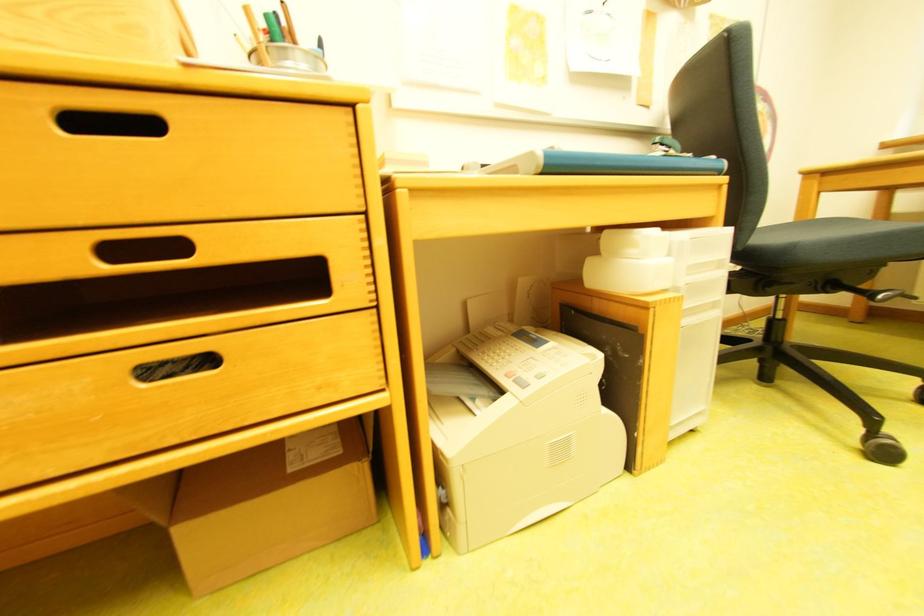
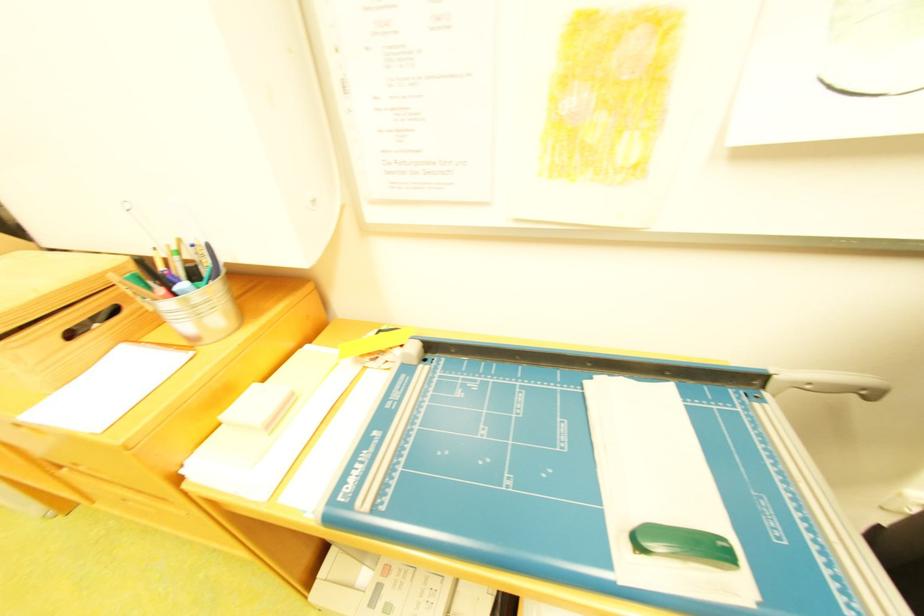
Question: I am providing you with two images of the same scene from different viewpoints. After the viewpoint changes to image2, which objects are now occluded?

Choices:
 (A) silver chair handle
 (B) drawer handle
 (C) wooden drawer handle
 (D) small white notepad

Answer: (C)